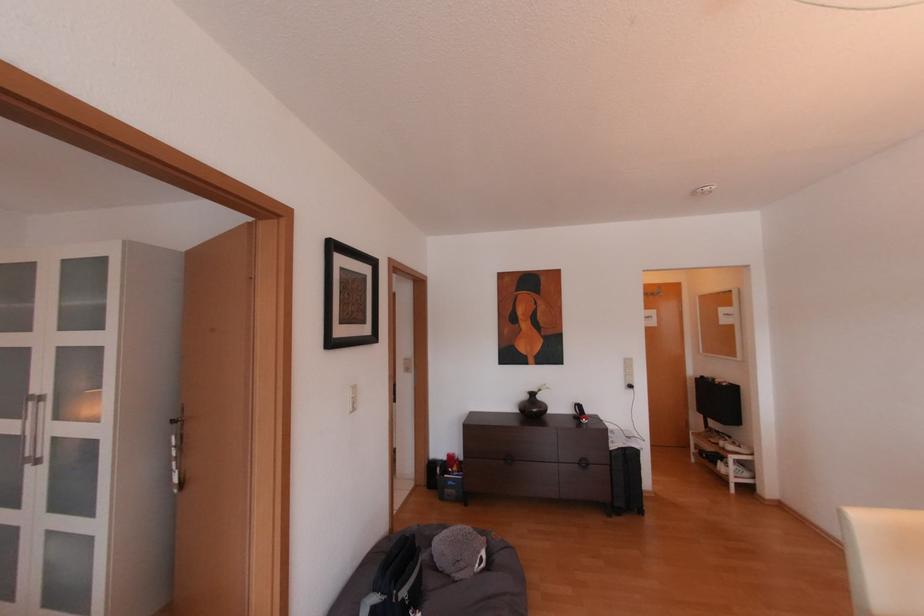
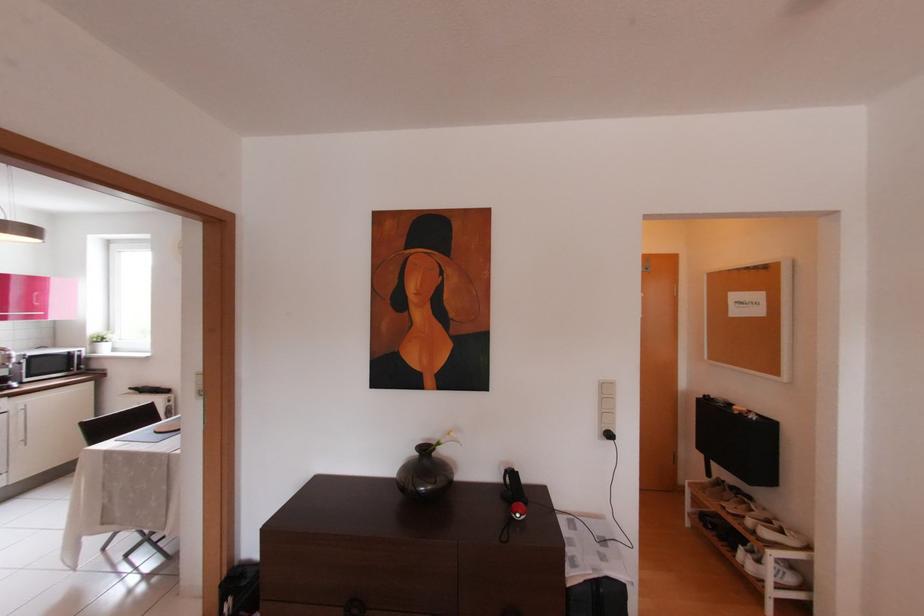
The images are taken continuously from a first-person perspective. In which direction are you moving?

The cameraman walked toward right, forward.